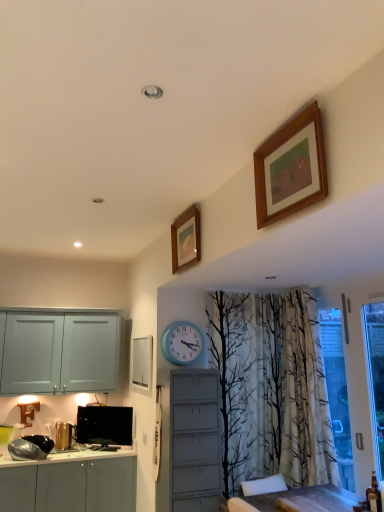
Question: Is wooden picture frame at upper center, which is counted as the second picture frame, starting from the top, positioned in front of white matte picture frame at center, the 1th picture frame positioned from the left?

Choices:
 (A) yes
 (B) no

Answer: (A)

Question: Considering the relative positions of wooden picture frame at upper center, positioned as the second picture frame in front-to-back order, and white matte picture frame at center, positioned as the 3th picture frame in top-to-bottom order, in the image provided, is wooden picture frame at upper center, positioned as the second picture frame in front-to-back order, to the left of white matte picture frame at center, positioned as the 3th picture frame in top-to-bottom order, from the viewer's perspective?

Choices:
 (A) no
 (B) yes

Answer: (A)

Question: Could you tell me if wooden picture frame at upper center, which is counted as the second picture frame, starting from the top, is facing white matte picture frame at center, the 1th picture frame positioned from the back?

Choices:
 (A) yes
 (B) no

Answer: (B)

Question: Is wooden picture frame at upper center, which is counted as the second picture frame, starting from the top, positioned beyond the bounds of white matte picture frame at center, the 1th picture frame positioned from the back?

Choices:
 (A) no
 (B) yes

Answer: (B)

Question: Can you confirm if wooden picture frame at upper center, the 2th picture frame when ordered from back to front, is smaller than white matte picture frame at center, the first picture frame positioned from the bottom?

Choices:
 (A) no
 (B) yes

Answer: (B)

Question: Does wooden picture frame at upper center, which is counted as the second picture frame, starting from the top, contain white matte picture frame at center, the 1th picture frame positioned from the left?

Choices:
 (A) yes
 (B) no

Answer: (B)

Question: Would you say wooden picture frame at upper center, the second picture frame positioned from the left, contains black glossy television at lower left?

Choices:
 (A) no
 (B) yes

Answer: (A)

Question: Can you confirm if wooden picture frame at upper center, the second picture frame positioned from the left, is smaller than black glossy television at lower left?

Choices:
 (A) yes
 (B) no

Answer: (B)

Question: Is the position of wooden picture frame at upper center, the second picture frame positioned from the left, more distant than that of black glossy television at lower left?

Choices:
 (A) no
 (B) yes

Answer: (A)

Question: Does wooden picture frame at upper center, which is counted as the second picture frame, starting from the top, have a greater height compared to black glossy television at lower left?

Choices:
 (A) no
 (B) yes

Answer: (B)

Question: Is wooden picture frame at upper center, positioned as the second picture frame in front-to-back order, oriented away from black glossy television at lower left?

Choices:
 (A) no
 (B) yes

Answer: (A)

Question: Is wooden picture frame at upper center, the 2th picture frame when ordered from back to front, thinner than black glossy television at lower left?

Choices:
 (A) yes
 (B) no

Answer: (B)

Question: From a real-world perspective, is black glossy television at lower left physically above wooden picture frame at upper center, which appears as the second picture frame when viewed from the right?

Choices:
 (A) no
 (B) yes

Answer: (A)